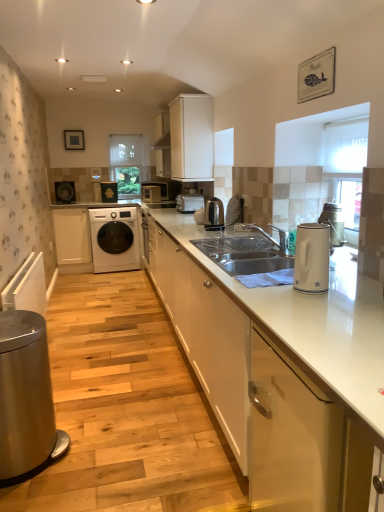
What do you see at coordinates (109, 192) in the screenshot? Image resolution: width=384 pixels, height=512 pixels. I see `white glossy microwave at center, which is the 2th appliance from left to right` at bounding box center [109, 192].

In order to face white glossy electric kettle at right, the 4th home appliance in the left-to-right sequence, should I rotate leftwards or rightwards?

Turn right by 15.646 degrees to look at white glossy electric kettle at right, the 4th home appliance in the left-to-right sequence.

What is the approximate height of metallic silver microwave at center, placed as the second appliance when sorted from right to left?

It is 8.29 inches.

The height and width of the screenshot is (512, 384). Identify the location of white glossy cabinet at lower right, which ranks as the 4th cabinetry in back-to-front order. (301, 440).

From the picture: Measure the distance between point (x=73, y=247) and camera.

5.39 meters.

Locate an element on the screen. white textured blinds at upper right, the 1th window screen ordered from the bottom is located at coordinates (346, 164).

Measure the distance between transparent glass window at center, which is the second window screen in front-to-back order, and camera.

The depth of transparent glass window at center, which is the second window screen in front-to-back order, is 18.03 feet.

You are a GUI agent. You are given a task and a screenshot of the screen. Output one action in this format:
    pyautogui.click(x=<x>, y=<y>)
    Task: Click on the white glossy microwave at center, the third appliance viewed from the right
    The width and height of the screenshot is (384, 512).
    Given the screenshot: What is the action you would take?
    pyautogui.click(x=109, y=192)

From the picture: Considering the positions of objects matte black washing machine at left, positioned as the 3th appliance in back-to-front order, and white glossy cabinet at center, acting as the 3th cabinetry starting from the back, in the image provided, who is behind, matte black washing machine at left, positioned as the 3th appliance in back-to-front order, or white glossy cabinet at center, acting as the 3th cabinetry starting from the back,?

matte black washing machine at left, positioned as the 3th appliance in back-to-front order, is behind.

Which point is more distant from viewer, (x=56, y=198) or (x=304, y=486)?

Point (x=56, y=198)

Is matte black washing machine at left, positioned as the 3th appliance in back-to-front order, placed right next to white glossy cabinet at center, which is the 3th cabinetry in left-to-right order?

No, matte black washing machine at left, positioned as the 3th appliance in back-to-front order, is not making contact with white glossy cabinet at center, which is the 3th cabinetry in left-to-right order.

Can you tell me how much matte black washing machine at left, placed as the first appliance when sorted from left to right, and white glossy cabinet at center, which is the 3th cabinetry in left-to-right order, differ in facing direction?

106 degrees.

What are the coordinates of `appliance that is the 3rd object above the white glossy cabinet at lower right, which appears as the first cabinetry when viewed from the right (from a real-world perspective)` in the screenshot? It's located at (109, 192).

Based on the photo, from a real-world perspective, between white glossy cabinet at lower right, which ranks as the 4th cabinetry in back-to-front order, and white glossy microwave at center, the third appliance viewed from the right, who is vertically lower?

white glossy cabinet at lower right, which ranks as the 4th cabinetry in back-to-front order, is physically lower.

Between white glossy cabinet at lower right, which ranks as the 4th cabinetry in back-to-front order, and white matte cabinet at left, which ranks as the 4th cabinetry in front-to-back order, which one has smaller size?

white matte cabinet at left, which ranks as the 4th cabinetry in front-to-back order, is smaller.

Can you tell me how much white glossy cabinet at lower right, which is the 4th cabinetry in left-to-right order, and white matte cabinet at left, marked as the fourth cabinetry in a right-to-left arrangement, differ in facing direction?

90.4 degrees separate the facing orientations of white glossy cabinet at lower right, which is the 4th cabinetry in left-to-right order, and white matte cabinet at left, marked as the fourth cabinetry in a right-to-left arrangement.

Which is more to the right, white glossy cabinet at lower right, the first cabinetry viewed from the front, or white matte cabinet at left, which ranks as the 4th cabinetry in front-to-back order?

white glossy cabinet at lower right, the first cabinetry viewed from the front, is more to the right.

Considering the sizes of objects white glossy cabinet at lower right, which ranks as the 4th cabinetry in back-to-front order, and white matte cabinet at left, which is the 1th cabinetry from left to right, in the image provided, who is taller, white glossy cabinet at lower right, which ranks as the 4th cabinetry in back-to-front order, or white matte cabinet at left, which is the 1th cabinetry from left to right,?

white matte cabinet at left, which is the 1th cabinetry from left to right, is taller.

Considering the sizes of objects white glossy electric kettle at right, which is the third home appliance in top-to-bottom order, and white matte cabinet at upper center, placed as the third cabinetry when sorted from front to back, in the image provided, who is thinner, white glossy electric kettle at right, which is the third home appliance in top-to-bottom order, or white matte cabinet at upper center, placed as the third cabinetry when sorted from front to back,?

white glossy electric kettle at right, which is the third home appliance in top-to-bottom order, is thinner.

Is white glossy electric kettle at right, the 1th home appliance positioned from the front, not close to white matte cabinet at upper center, acting as the third cabinetry starting from the right?

Yes, white glossy electric kettle at right, the 1th home appliance positioned from the front, and white matte cabinet at upper center, acting as the third cabinetry starting from the right, are quite far apart.

Is white glossy electric kettle at right, marked as the 4th home appliance in a back-to-front arrangement, facing away from white matte cabinet at upper center, which appears as the second cabinetry when viewed from the left?

That's not correct — white glossy electric kettle at right, marked as the 4th home appliance in a back-to-front arrangement, is not looking away from white matte cabinet at upper center, which appears as the second cabinetry when viewed from the left.

Can we say white glossy electric kettle at right, the 1th home appliance positioned from the front, lies outside white matte cabinet at upper center, arranged as the 2th cabinetry when viewed from the back?

Answer: Yes.

Which home appliance is the 3rd one when counting from the right side of the white matte cabinet at left, which ranks as the 4th cabinetry in front-to-back order? Please provide its 2D coordinates.

[(189, 203)]

Is satin silver toaster at center, the 2th home appliance when ordered from top to bottom, looking in the opposite direction of white matte cabinet at left, marked as the fourth cabinetry in a right-to-left arrangement?

No, satin silver toaster at center, the 2th home appliance when ordered from top to bottom,'s orientation is not away from white matte cabinet at left, marked as the fourth cabinetry in a right-to-left arrangement.

Does point (191, 210) appear closer or farther from the camera than point (65, 243)?

Point (191, 210).

From the image's perspective, which object appears higher, satin silver toaster at center, marked as the 3th home appliance in a left-to-right arrangement, or white matte cabinet at left, placed as the first cabinetry when sorted from back to front?

From the image's view, satin silver toaster at center, marked as the 3th home appliance in a left-to-right arrangement, is above.

From the image's perspective, is satin silver toaster at center, which is counted as the third home appliance, starting from the front, below transparent glass window at center, the 2th window screen from the bottom?

Yes.

Is satin silver toaster at center, which is counted as the third home appliance, starting from the front, oriented away from transparent glass window at center, the 2th window screen from the bottom?

No, transparent glass window at center, the 2th window screen from the bottom, is not at the back of satin silver toaster at center, which is counted as the third home appliance, starting from the front.

Looking at this image, considering the sizes of satin silver toaster at center, the 2th home appliance when ordered from top to bottom, and transparent glass window at center, the first window screen in the left-to-right sequence, in the image, is satin silver toaster at center, the 2th home appliance when ordered from top to bottom, wider or thinner than transparent glass window at center, the first window screen in the left-to-right sequence,?

Clearly, satin silver toaster at center, the 2th home appliance when ordered from top to bottom, has more width compared to transparent glass window at center, the first window screen in the left-to-right sequence.

Are satin silver toaster at center, the 2th home appliance positioned from the back, and transparent glass window at center, which is counted as the first window screen, starting from the back, beside each other?

No, satin silver toaster at center, the 2th home appliance positioned from the back, is not next to transparent glass window at center, which is counted as the first window screen, starting from the back.

Between white glossy washing machine at center and matte black microwave at center, which is the third home appliance in right-to-left order, which one appears on the right side from the viewer's perspective?

From the viewer's perspective, matte black microwave at center, which is the third home appliance in right-to-left order, appears more on the right side.

Considering the sizes of white glossy washing machine at center and matte black microwave at center, which is the 2th home appliance from left to right, in the image, is white glossy washing machine at center bigger or smaller than matte black microwave at center, which is the 2th home appliance from left to right,?

white glossy washing machine at center is bigger than matte black microwave at center, which is the 2th home appliance from left to right.

Is white glossy washing machine at center oriented towards matte black microwave at center, arranged as the fourth home appliance when ordered from the bottom?

No, white glossy washing machine at center does not turn towards matte black microwave at center, arranged as the fourth home appliance when ordered from the bottom.

Considering the points (110, 230) and (147, 200), which point is behind, point (110, 230) or point (147, 200)?

The point (147, 200) is more distant.

This screenshot has height=512, width=384. What are the coordinates of `the 2nd appliance behind when counting from the white glossy cabinet at center, acting as the 3th cabinetry starting from the back` in the screenshot? It's located at (65, 192).

Find the location of a particular element. cabinetry that is the 3rd object located below the white glossy microwave at center, acting as the 1th appliance starting from the back (from the image's perspective) is located at coordinates (301, 440).

In the scene shown: Looking at the image, which one is located closer to metallic silver microwave at center, acting as the second appliance starting from the back, transparent glass window at center, the 2th window screen from the bottom, or satin silver toaster at center, the 2th home appliance positioned from the back?

transparent glass window at center, the 2th window screen from the bottom.

From the image, which object appears to be farther from satin silver toaster at center, the 2th home appliance positioned from the back, white glossy cabinet at center, which is the 3th cabinetry in left-to-right order, or white matte cabinet at upper center, placed as the third cabinetry when sorted from front to back?

white glossy cabinet at center, which is the 3th cabinetry in left-to-right order, is further to satin silver toaster at center, the 2th home appliance positioned from the back.

When comparing their distances from satin silver toaster at center, the 2th home appliance when ordered from top to bottom, does transparent glass window at center, which is the second window screen in front-to-back order, or satin nickel kettle at center, the first appliance positioned from the front, seem closer?

satin nickel kettle at center, the first appliance positioned from the front, lies closer to satin silver toaster at center, the 2th home appliance when ordered from top to bottom, than the other object.

Estimate the real-world distances between objects in this image. Which object is closer to matte black washing machine at left, the fourth appliance from the right, white matte cabinet at upper center, which appears as the second cabinetry when viewed from the left, or matte black microwave at center, which is the 2th home appliance from left to right?

matte black microwave at center, which is the 2th home appliance from left to right.

Looking at the image, which one is located further to white glossy cabinet at center, the 2th cabinetry from the right, satin silver toaster at center, marked as the 3th home appliance in a left-to-right arrangement, or white textured blinds at upper right, marked as the 1th window screen in a right-to-left arrangement?

Based on the image, satin silver toaster at center, marked as the 3th home appliance in a left-to-right arrangement, appears to be further to white glossy cabinet at center, the 2th cabinetry from the right.

From the image, which object appears to be nearer to matte black washing machine at left, the second appliance from the front, white glossy electric kettle at right, arranged as the 1th home appliance when viewed from the right, or white matte cabinet at left, which is the 1th cabinetry from left to right?

white matte cabinet at left, which is the 1th cabinetry from left to right, lies closer to matte black washing machine at left, the second appliance from the front, than the other object.

Looking at the image, which one is located further to white glossy cabinet at lower right, which ranks as the 4th cabinetry in back-to-front order, white matte cabinet at left, which ranks as the 4th cabinetry in front-to-back order, or satin silver toaster at center, the 2th home appliance positioned from the back?

Based on the image, white matte cabinet at left, which ranks as the 4th cabinetry in front-to-back order, appears to be further to white glossy cabinet at lower right, which ranks as the 4th cabinetry in back-to-front order.

Looking at the image, which one is located further to white glossy cabinet at lower right, which appears as the first cabinetry when viewed from the right, metallic silver microwave at center, which is the 3th appliance in left-to-right order, or satin nickel kettle at center, the 1th appliance in the right-to-left sequence?

metallic silver microwave at center, which is the 3th appliance in left-to-right order, is positioned further to the anchor white glossy cabinet at lower right, which appears as the first cabinetry when viewed from the right.

Identify the location of home appliance positioned between white glossy electric kettle at right, marked as the 2th home appliance in a bottom-to-top arrangement, and satin nickel kettle at center, the 1th appliance in the right-to-left sequence, from near to far. (26, 399).

Identify the location of home appliance between white textured blinds at upper right, marked as the 1th window screen in a right-to-left arrangement, and metallic silver microwave at center, the 3th appliance in the front-to-back sequence, in the front-back direction. The image size is (384, 512). (189, 203).

This screenshot has width=384, height=512. In order to click on home appliance between white matte cabinet at upper center, arranged as the 2th cabinetry when viewed from the back, and white glossy microwave at center, which is the 2th appliance from left to right, from front to back in this screenshot , I will do `click(189, 203)`.

Identify the location of washing machine between matte black washing machine at left, the fourth appliance from the right, and white matte cabinet at upper center, which appears as the second cabinetry when viewed from the left, in the horizontal direction. The width and height of the screenshot is (384, 512). (114, 239).